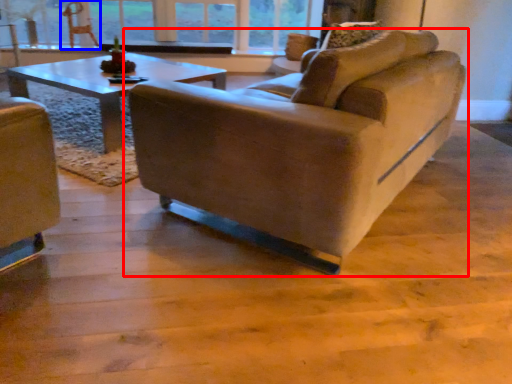
Question: Which object appears farthest to the camera in this image, studio couch (highlighted by a red box) or swivel chair (highlighted by a blue box)?

Choices:
 (A) studio couch
 (B) swivel chair

Answer: (B)